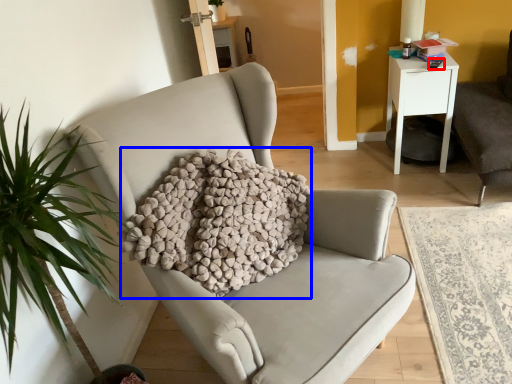
Question: Which of the following is the closest to the observer, remote control (highlighted by a red box) or pillow (highlighted by a blue box)?

Choices:
 (A) remote control
 (B) pillow

Answer: (B)